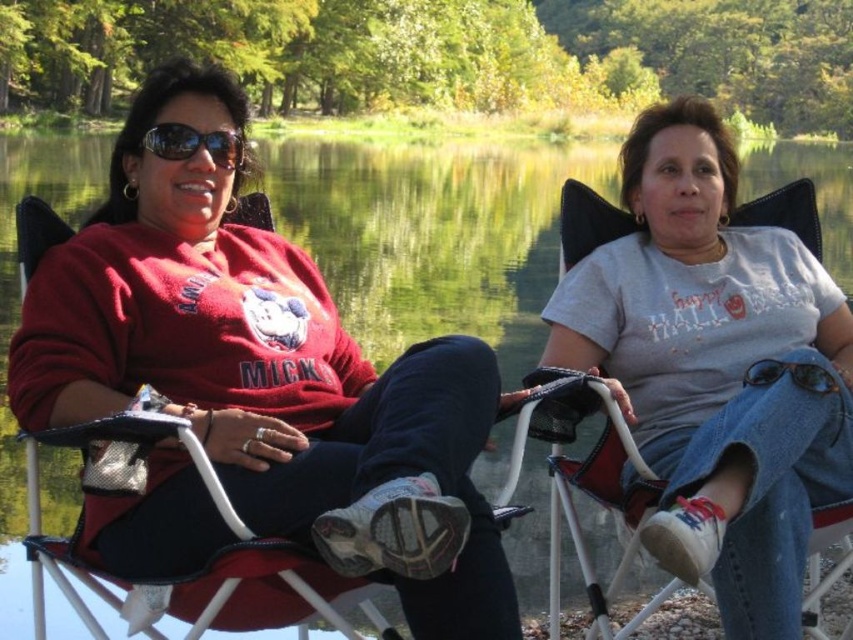
Question: Does matte red sweatshirt at left appear on the right side of sunglasses at left?

Choices:
 (A) no
 (B) yes

Answer: (B)

Question: Does matte red sweatshirt at left have a larger size compared to sunglasses at left?

Choices:
 (A) yes
 (B) no

Answer: (A)

Question: Among these objects, which one is nearest to the camera?

Choices:
 (A) matte red sweatshirt at left
 (B) denim fabric chair at center

Answer: (A)

Question: Based on their relative distances, which object is farther from the denim fabric chair at center?

Choices:
 (A) sunglasses at left
 (B) matte red sweatshirt at left

Answer: (A)

Question: Which point is closer to the camera taking this photo?

Choices:
 (A) [225, 168]
 (B) [838, 520]

Answer: (B)

Question: Can you confirm if matte red sweatshirt at left is positioned to the left of sunglasses at left?

Choices:
 (A) yes
 (B) no

Answer: (B)